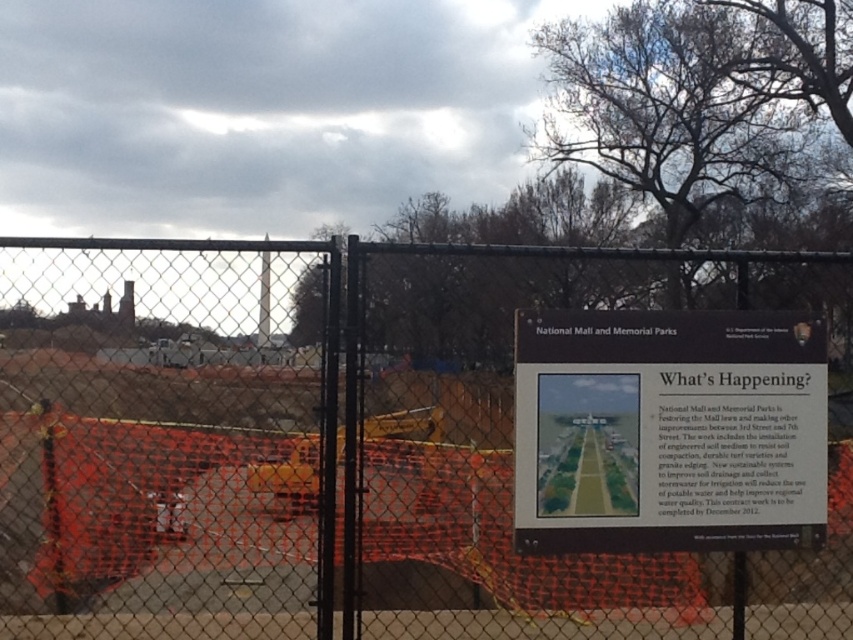
You are standing at the construction site fence at the National Mall and Memorial Parks. You see two points marked on the ground in front of you. The first point is at coordinate point (224, 308) and the second point is at coordinate point (595, 524). If you want to place a safety cone on the point that is closer to your current position, which coordinate should you choose?

You should place the safety cone at point (224, 308) because it is closer to your current position than point (595, 524).

From the picture: You are a visitor at the National Mall and Memorial Parks. You see an orange mesh fence at left and a wooden signboard at center. Which object is closer to the ground?

The orange mesh fence at left is positioned under the wooden signboard at center, so it is closer to the ground.

You are a visitor at the National Mall and Memorial Parks. You see an orange mesh fence at left and a wooden signboard at center. Which object is larger in size?

The orange mesh fence at left is bigger than the wooden signboard at center.